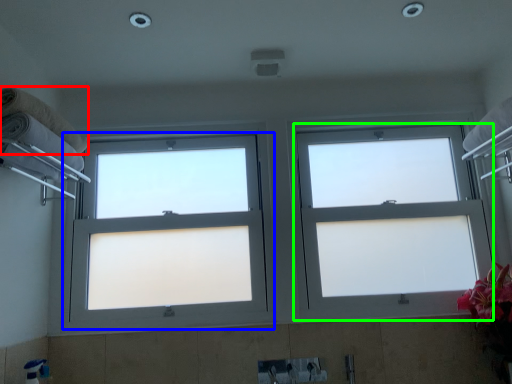
Question: Based on their relative distances, which object is nearer to towel (highlighted by a red box)? Choose from window (highlighted by a blue box) and window (highlighted by a green box).

Choices:
 (A) window
 (B) window

Answer: (A)